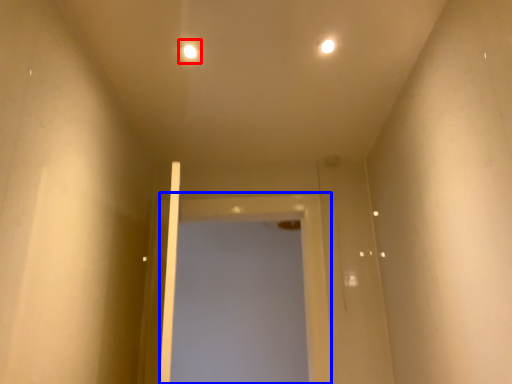
Question: Which object is further to the camera taking this photo, light (highlighted by a red box) or screen door (highlighted by a blue box)?

Choices:
 (A) light
 (B) screen door

Answer: (B)